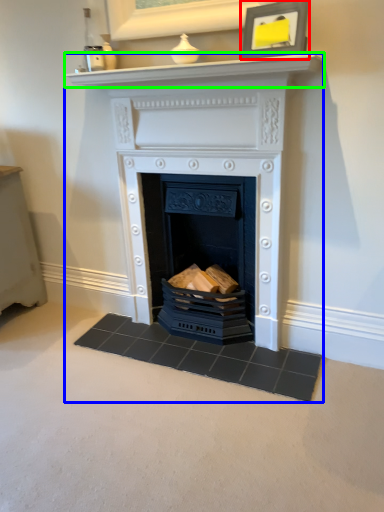
Question: Which is farther away from picture frame (highlighted by a red box)? fireplace (highlighted by a blue box) or mantle (highlighted by a green box)?

Choices:
 (A) fireplace
 (B) mantle

Answer: (A)